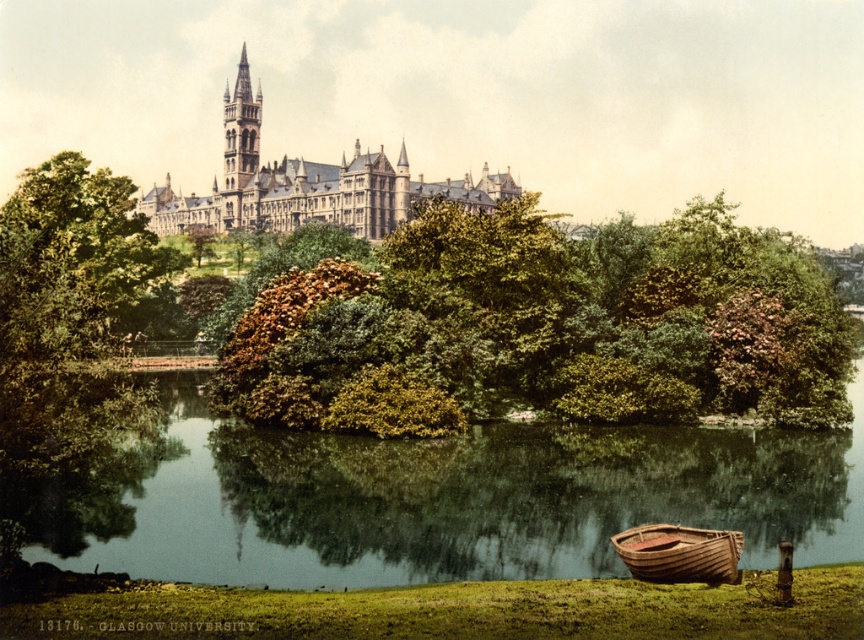
In the scene shown: Who is more distant from viewer, (87,285) or (210,237)?

Point (210,237)

Who is positioned more to the left, green leafy tree at left or green leafy tree at center?

green leafy tree at left

Based on the photo, who is more distant from viewer, (112, 292) or (205, 250)?

Point (205, 250)

Image resolution: width=864 pixels, height=640 pixels. Find the location of `green leafy tree at left`. green leafy tree at left is located at coordinates (71, 260).

Is green leafy tree at left taller than stone castle at upper center?

No, green leafy tree at left is not taller than stone castle at upper center.

Which is behind, point (111, 202) or point (159, 188)?

Point (159, 188)

The height and width of the screenshot is (640, 864). Find the location of `green leafy tree at left`. green leafy tree at left is located at coordinates (71, 260).

Which of these two, green grassy river at lower center or green leafy tree at center, stands taller?

green grassy river at lower center is taller.

Does green grassy river at lower center come in front of green leafy tree at center?

Yes, green grassy river at lower center is closer to the viewer.

Does point (242, 451) lie in front of point (199, 236)?

Yes, point (242, 451) is closer to viewer.

Image resolution: width=864 pixels, height=640 pixels. Find the location of `green grassy river at lower center`. green grassy river at lower center is located at coordinates (430, 499).